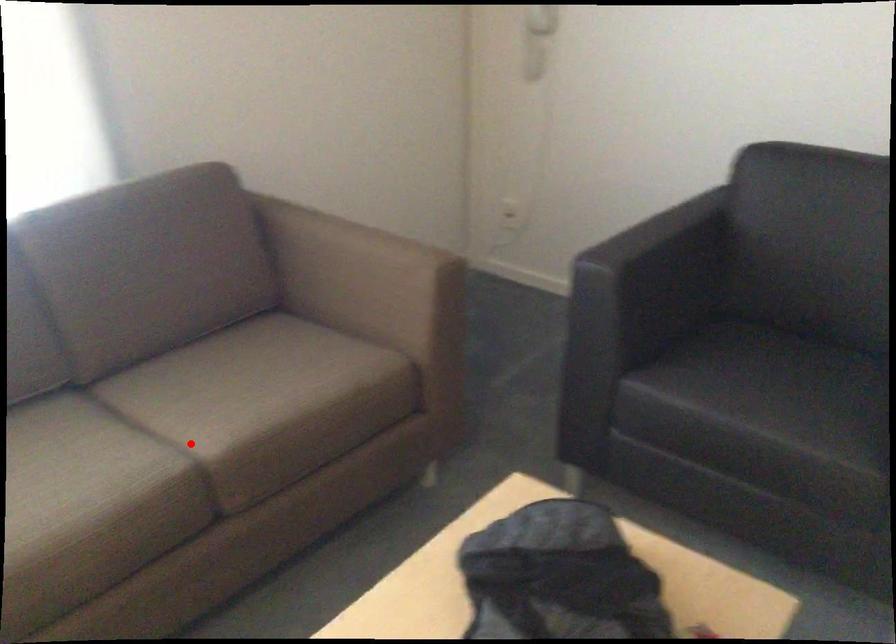
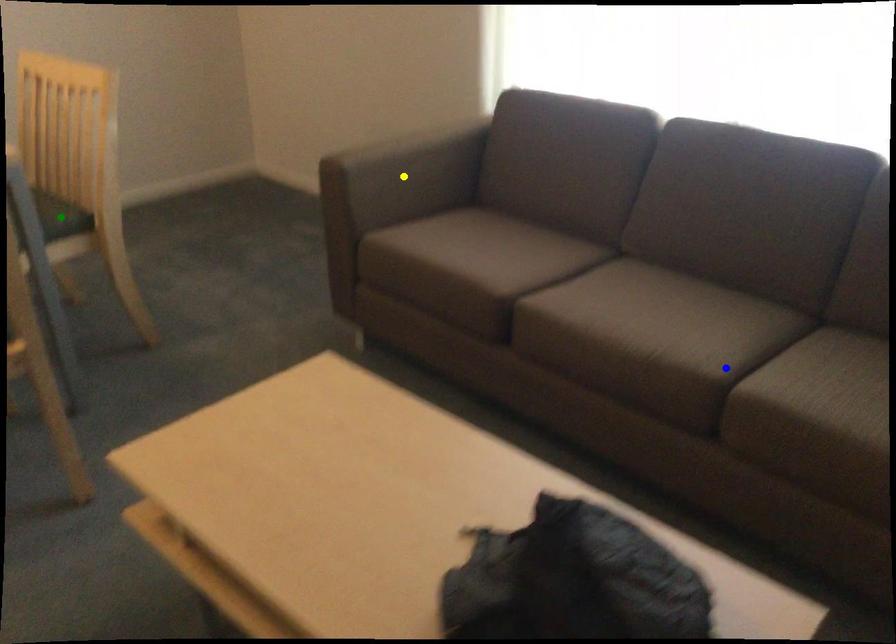
Question: I am providing you with two images of the same scene from different viewpoints. A red point is marked on the first image. You are given multiple points on the second image. Which mark in image 2 goes with the point in image 1?

Choices:
 (A) blue point
 (B) green point
 (C) yellow point

Answer: (A)